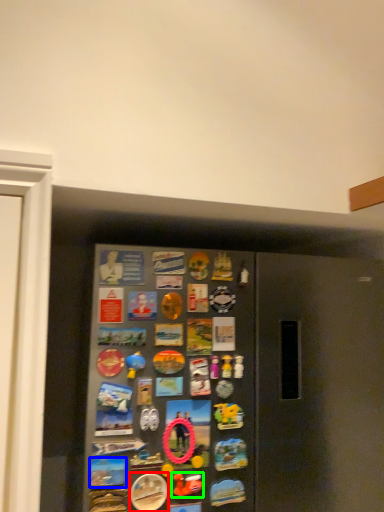
Question: Considering the real-world distances, which object is closest to button (highlighted by a red box)? button (highlighted by a blue box) or art (highlighted by a green box).

Choices:
 (A) button
 (B) art

Answer: (B)